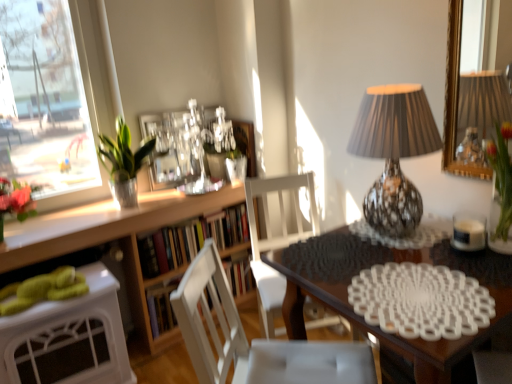
This screenshot has height=384, width=512. I want to click on free spot above white glossy desk at lower left (from a real-world perspective), so click(x=53, y=287).